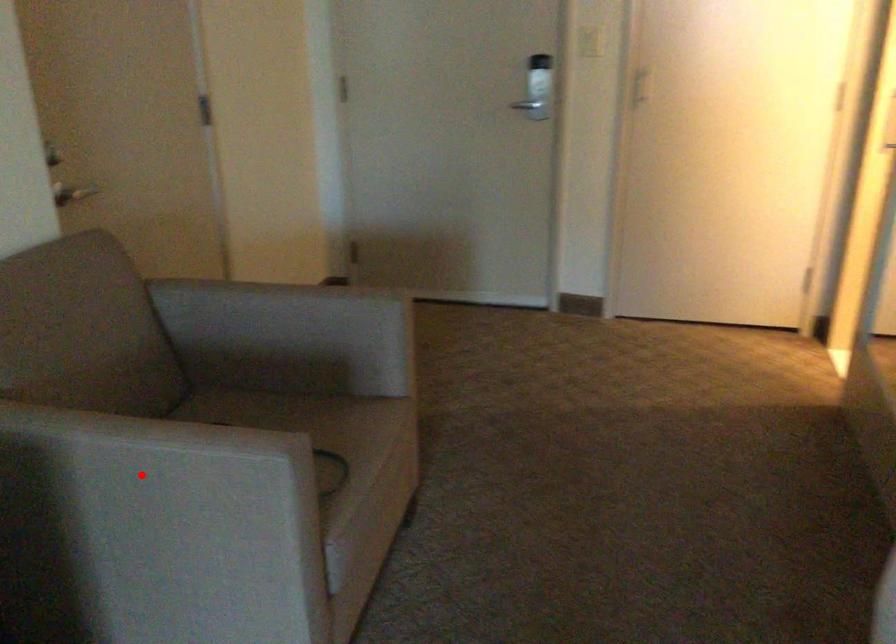
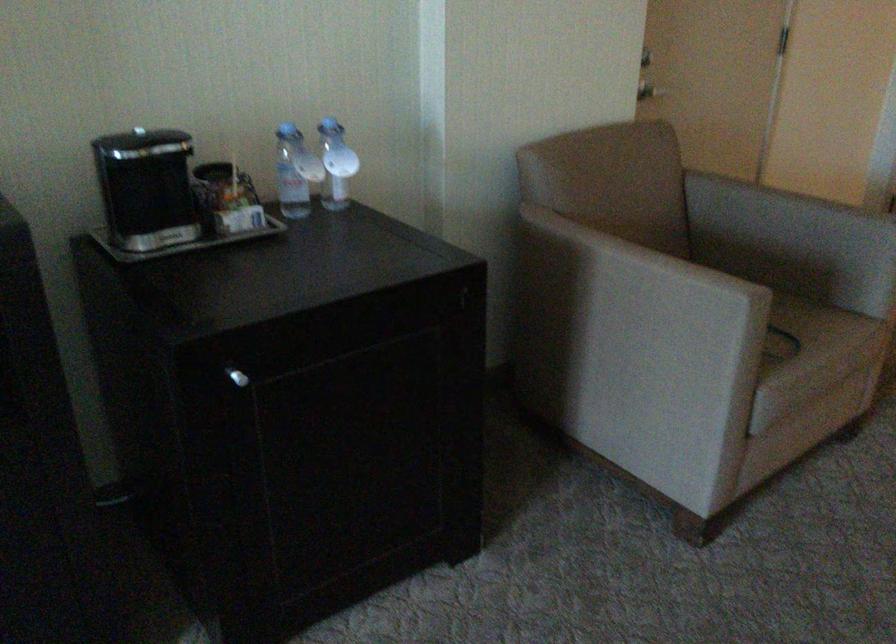
Where in the second image is the point corresponding to the highlighted location from the first image?

(631, 283)